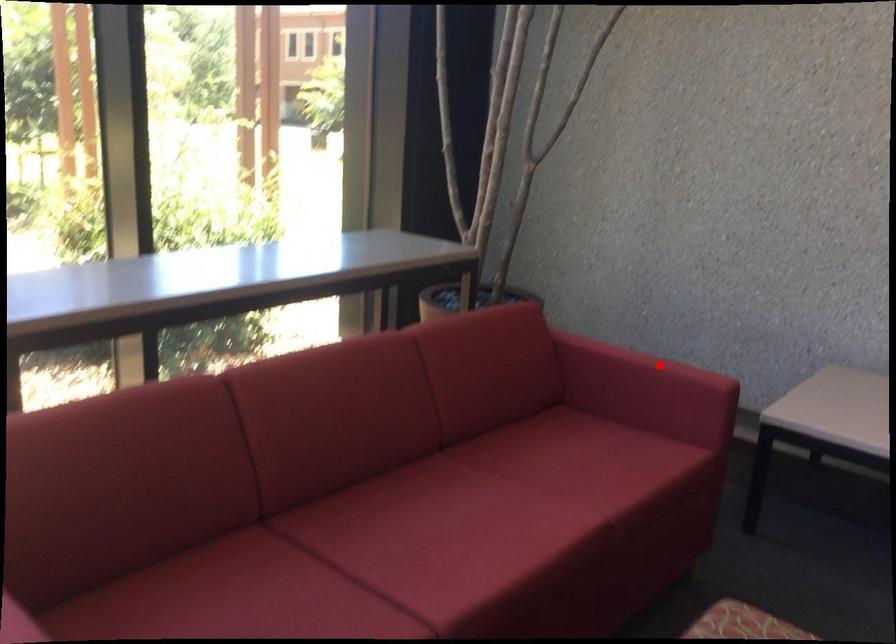
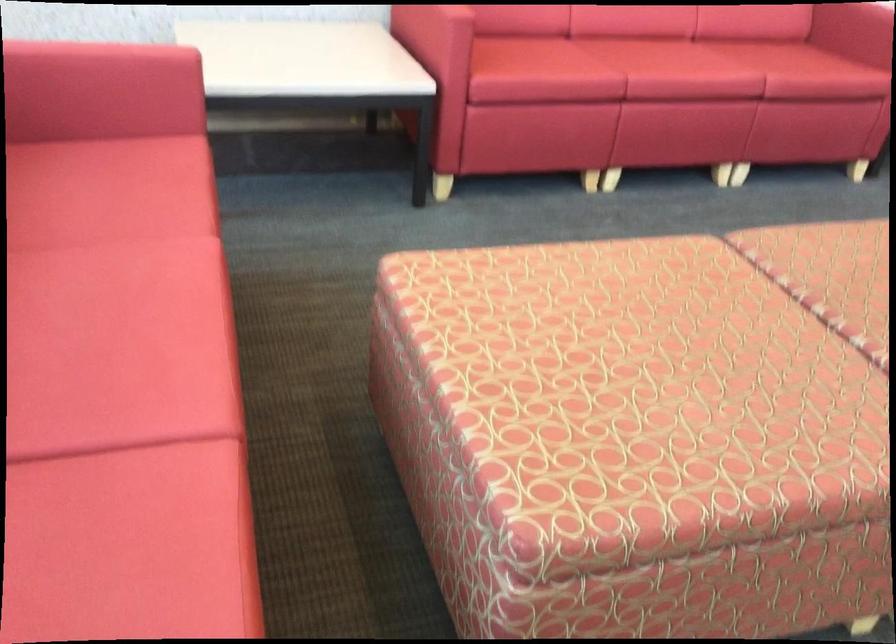
Locate, in the second image, the point that corresponds to the highlighted location in the first image.

(102, 53)